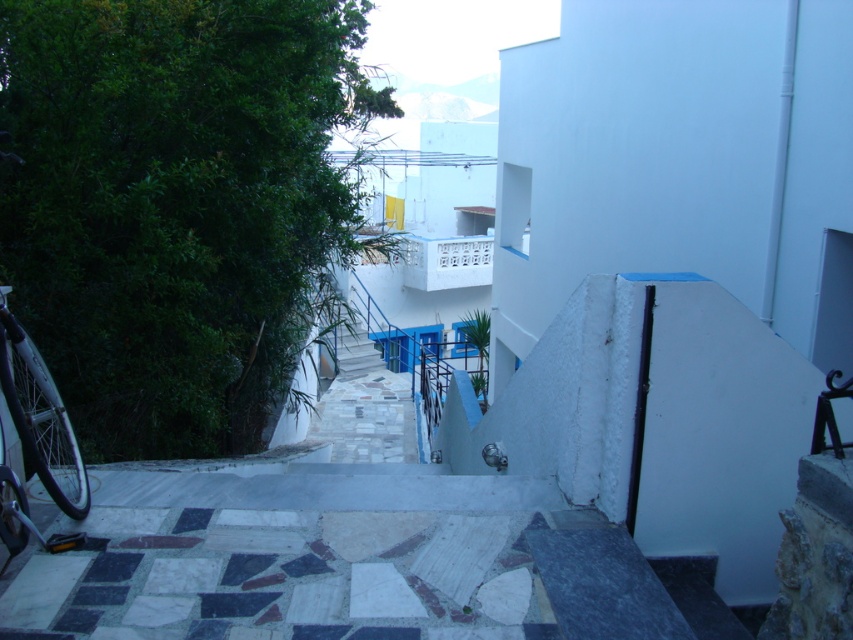
Consider the image. Does silver metallic bicycle at left have a smaller size compared to white marble stairs at center?

Yes.

Does silver metallic bicycle at left have a lesser height compared to white marble stairs at center?

Indeed, silver metallic bicycle at left has a lesser height compared to white marble stairs at center.

Locate an element on the screen. This screenshot has width=853, height=640. silver metallic bicycle at left is located at coordinates (39, 417).

Find the location of a particular element. The height and width of the screenshot is (640, 853). silver metallic bicycle at left is located at coordinates (39, 417).